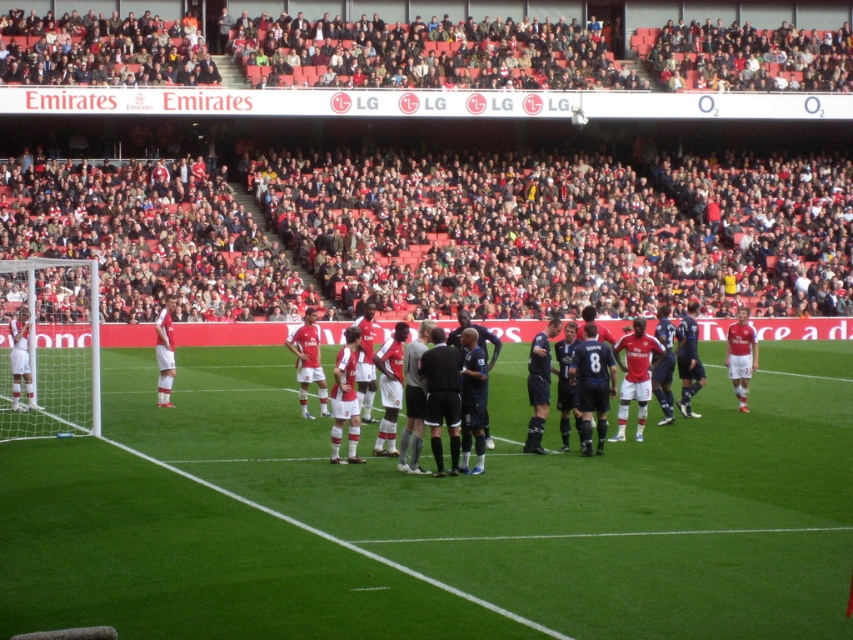
You are a photographer positioned at the point with coordinates (688, 358). You want to capture a photo of the dark blue jersey at center. Is the dark blue jersey at center visible from your current position?

The point with coordinates (688, 358) indicates the dark blue jersey at center, so yes, the dark blue jersey at center is visible from your current position.

You are a photographer at the soccer match and want to capture a photo of the dark blue jersey at center and the black smooth shirt at center. Based on their positions, which one is positioned lower in the image?

The black smooth shirt at center is located below the dark blue jersey at center, so it is positioned lower in the image.